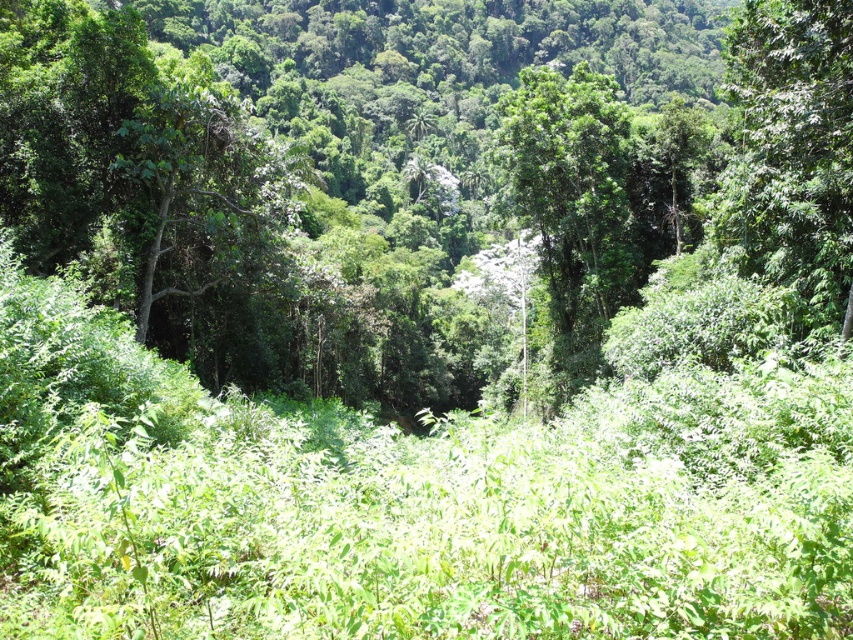
Is green leafy tree at upper right wider than green leafy tree at center?

No, green leafy tree at upper right is not wider than green leafy tree at center.

From the picture: Who is more distant from viewer, (752, 260) or (585, 371)?

The point (585, 371) is more distant.

Consider the image. Who is more distant from viewer, (744, 134) or (610, 83)?

Point (610, 83)

I want to click on green leafy tree at upper right, so click(x=791, y=148).